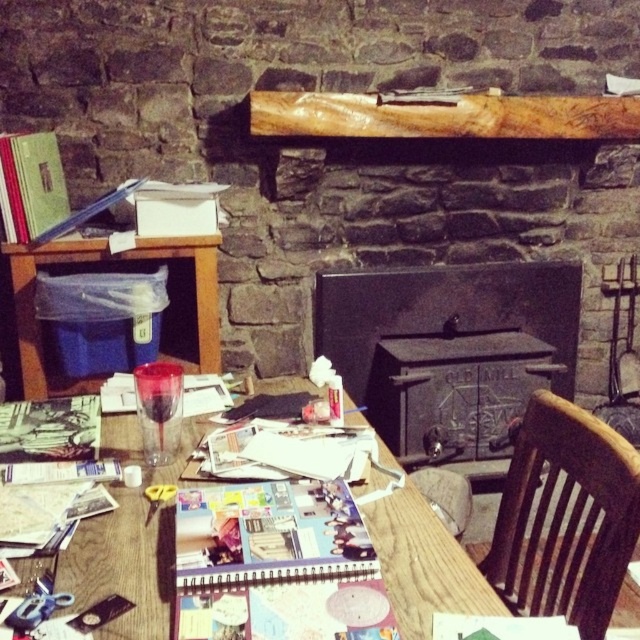
Looking at this image, can you confirm if black cast iron stove at center is positioned below wooden table at center?

No.

Is point (364, 349) positioned before point (100, 433)?

No.

This screenshot has height=640, width=640. I want to click on black cast iron stove at center, so click(445, 342).

Who is higher up, wooden table at center or yellow plastic scissors at lower left?

wooden table at center

Does wooden table at center have a lesser width compared to yellow plastic scissors at lower left?

Incorrect, wooden table at center's width is not less than yellow plastic scissors at lower left's.

You are a GUI agent. You are given a task and a screenshot of the screen. Output one action in this format:
    pyautogui.click(x=<x>, y=<y>)
    Task: Click on the wooden table at center
    Image resolution: width=640 pixels, height=640 pixels.
    Given the screenshot: What is the action you would take?
    pyautogui.click(x=129, y=541)

This screenshot has width=640, height=640. What are the coordinates of `wooden plank at upper center` in the screenshot? It's located at (444, 116).

Is point (272, 115) farther from camera compared to point (177, 294)?

No, (272, 115) is in front of (177, 294).

Locate an element on the screen. wooden plank at upper center is located at coordinates (444, 116).